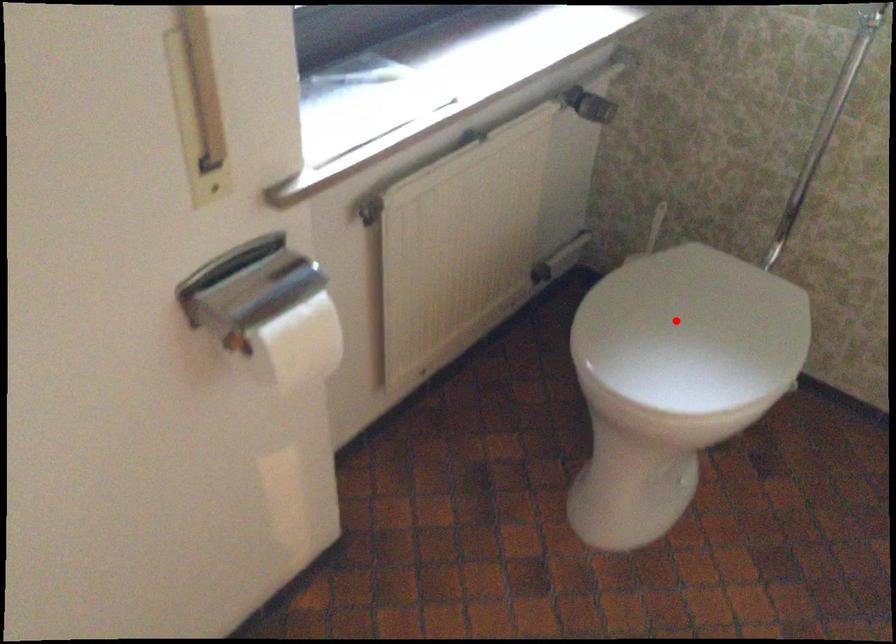
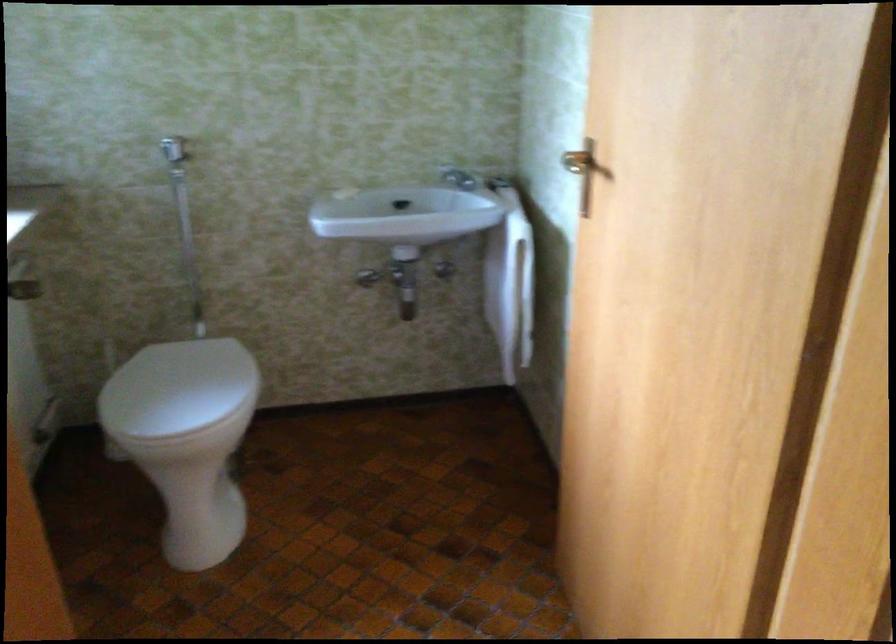
Question: I am providing you with two images of the same scene from different viewpoints. In image1, a red point is highlighted. Considering the same 3D point in image2, which of the following is correct?

Choices:
 (A) It is closer
 (B) It is farther

Answer: (B)